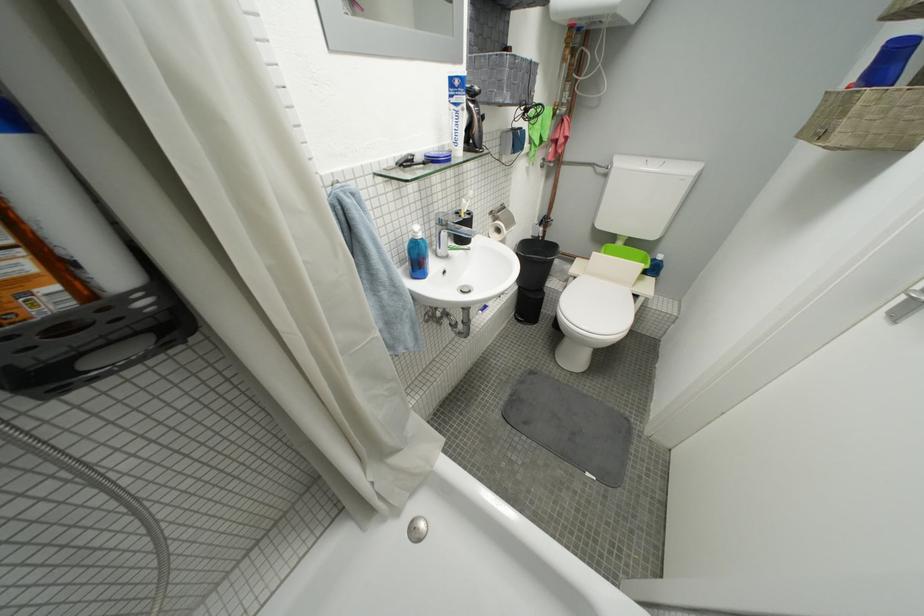
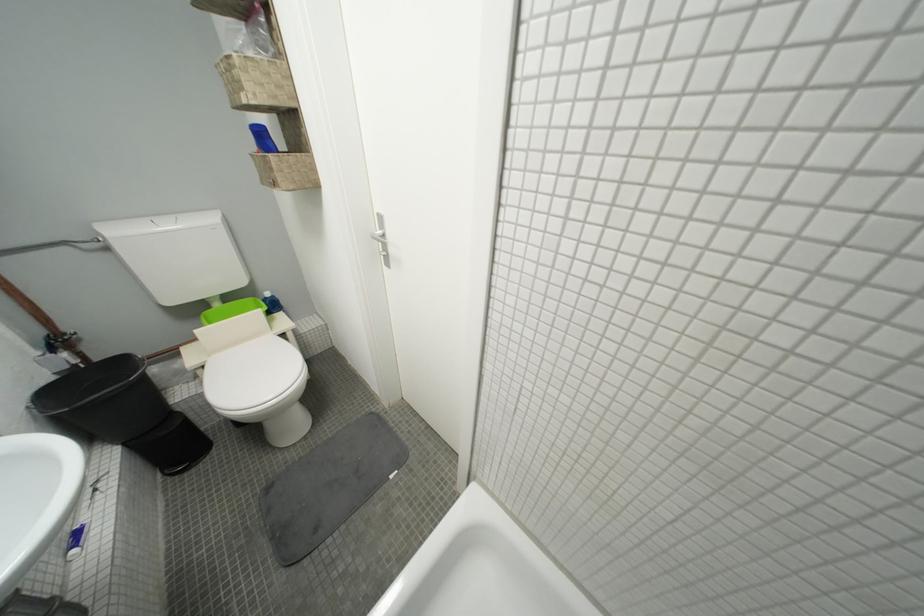
Consider the image. First-person continuous shooting, in which direction is the camera rotating?

The camera rotated toward right-down.